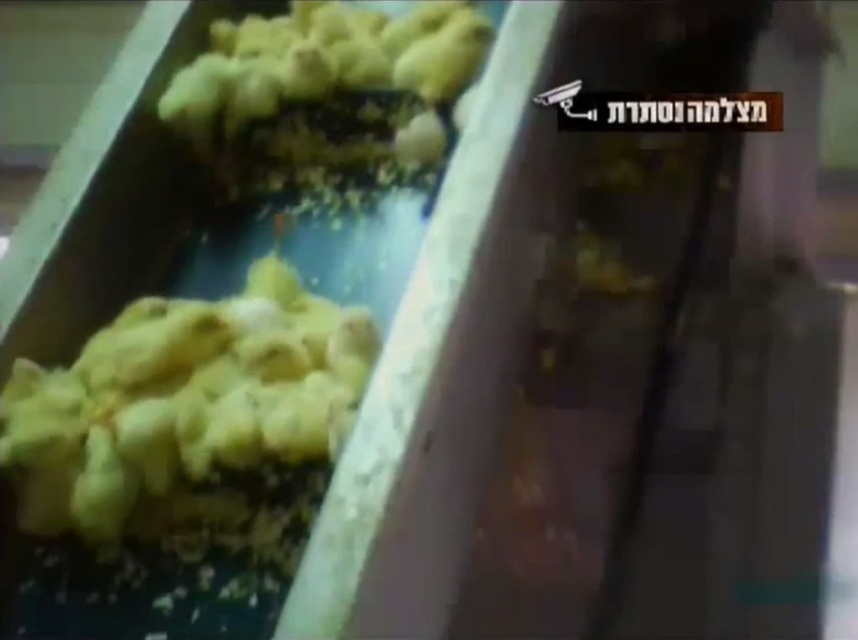
You are a poultry worker observing the chicks on the conveyor belt. You notice two groups of yellow matte chicks at left and yellow matte chicks at upper left. Which group appears taller?

The yellow matte chicks at left appears taller than the yellow matte chicks at upper left.

You are a poultry worker who needs to place a food dispenser on the conveyor belt. The dispenser must be placed between the two points, point 1 at point (210, 522) and point 2 at point (281, 145). Based on the scene, which point is closer to the front of the conveyor belt where you should position the dispenser?

Point 1 at point (210, 522) is closer to the front of the conveyor belt because it is in front of point 2 at point (281, 145). Therefore, you should position the dispenser near point 1 at point (210, 522) to ensure it is placed correctly along the conveyor belt.

You are a poultry worker who needs to locate the yellow matte chicks at left on the conveyor belt. According to the system coordinates, where exactly are they positioned?

The yellow matte chicks at left are positioned at point (185, 413).